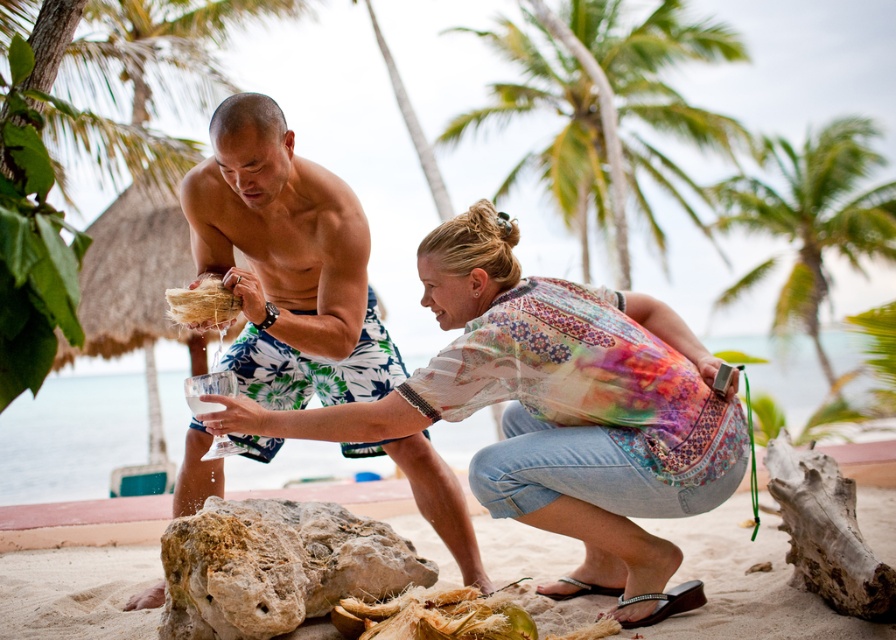
Is rusty textured rock at center further to camera compared to green leafy palm tree at upper right?

No, it is in front of green leafy palm tree at upper right.

Who is higher up, rusty textured rock at center or green leafy palm tree at upper right?

green leafy palm tree at upper right is above.

Between point (293, 554) and point (802, 296), which one is positioned in front?

Point (293, 554) is in front.

At what (x,y) coordinates should I click in order to perform the action: click on rusty textured rock at center. Please return your answer as a coordinate pair (x, y). Looking at the image, I should click on (274, 566).

Is green leafy palm tree at upper center above green leafy palm tree at upper right?

Indeed, green leafy palm tree at upper center is positioned over green leafy palm tree at upper right.

Does green leafy palm tree at upper center come in front of green leafy palm tree at upper right?

Yes.

Locate an element on the screen. The height and width of the screenshot is (640, 896). green leafy palm tree at upper center is located at coordinates (605, 109).

Locate an element on the screen. green leafy palm tree at upper center is located at coordinates (605, 109).

Is green leafy palm tree at upper center to the right of rusty textured rock at center from the viewer's perspective?

Indeed, green leafy palm tree at upper center is positioned on the right side of rusty textured rock at center.

Is green leafy palm tree at upper center taller than rusty textured rock at center?

Correct, green leafy palm tree at upper center is much taller as rusty textured rock at center.

Is point (538, 74) positioned in front of point (260, 524)?

No.

Find the location of a particular element. This screenshot has width=896, height=640. green leafy palm tree at upper center is located at coordinates (605, 109).